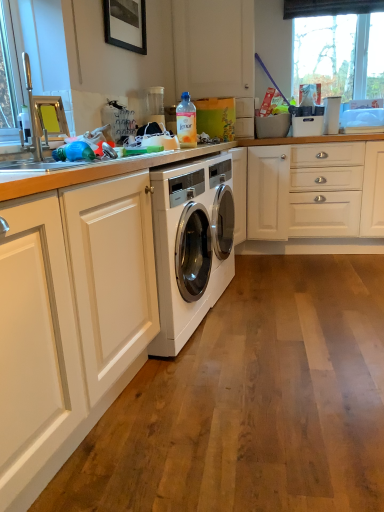
Question: Is transparent glass window at upper right bigger than translucent plastic bottle at upper center?

Choices:
 (A) yes
 (B) no

Answer: (A)

Question: Can you confirm if transparent glass window at upper right is taller than translucent plastic bottle at upper center?

Choices:
 (A) no
 (B) yes

Answer: (B)

Question: Does transparent glass window at upper right lie in front of translucent plastic bottle at upper center?

Choices:
 (A) yes
 (B) no

Answer: (B)

Question: Is transparent glass window at upper right not close to translucent plastic bottle at upper center?

Choices:
 (A) yes
 (B) no

Answer: (A)

Question: Is transparent glass window at upper right smaller than translucent plastic bottle at upper center?

Choices:
 (A) no
 (B) yes

Answer: (A)

Question: From the image's perspective, relative to white glossy washing machine at center, is brushed metal sink at left above or below?

Choices:
 (A) above
 (B) below

Answer: (A)

Question: Is brushed metal sink at left inside the boundaries of white glossy washing machine at center, or outside?

Choices:
 (A) inside
 (B) outside

Answer: (B)

Question: Would you say brushed metal sink at left is to the left or to the right of white glossy washing machine at center in the picture?

Choices:
 (A) left
 (B) right

Answer: (A)

Question: In the image, is brushed metal sink at left positioned in front of or behind white glossy washing machine at center?

Choices:
 (A) front
 (B) behind

Answer: (A)

Question: In terms of size, does transparent glass window at upper right appear bigger or smaller than brushed metal sink at left?

Choices:
 (A) big
 (B) small

Answer: (A)

Question: Is transparent glass window at upper right spatially inside brushed metal sink at left, or outside of it?

Choices:
 (A) outside
 (B) inside

Answer: (A)

Question: Considering the positions of transparent glass window at upper right and brushed metal sink at left in the image, is transparent glass window at upper right wider or thinner than brushed metal sink at left?

Choices:
 (A) wide
 (B) thin

Answer: (B)

Question: Considering the positions of transparent glass window at upper right and brushed metal sink at left in the image, is transparent glass window at upper right taller or shorter than brushed metal sink at left?

Choices:
 (A) tall
 (B) short

Answer: (A)

Question: Considering the positions of transparent glass window at upper right and translucent plastic bottle at upper center in the image, is transparent glass window at upper right taller or shorter than translucent plastic bottle at upper center?

Choices:
 (A) short
 (B) tall

Answer: (B)

Question: From a real-world perspective, is transparent glass window at upper right positioned above or below translucent plastic bottle at upper center?

Choices:
 (A) below
 (B) above

Answer: (B)